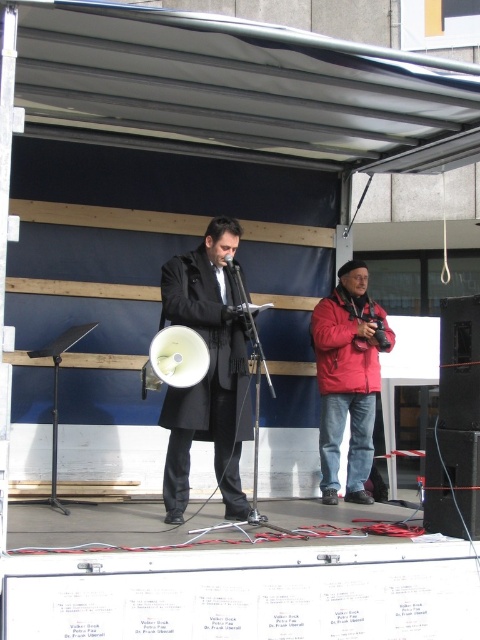
You are standing at the front of the stage and need to locate the black plastic speaker at center. According to the coordinates provided, where would you find it?

The black plastic speaker at center is located at point (459, 364).

You are standing at the back of the stage and want to walk towards the speaker. Which point, point (361,316) or point (434,449), is closer to you as you move forward?

Point (434,449) is closer to you because it is nearer to the camera compared to point (361,316), which is further away.